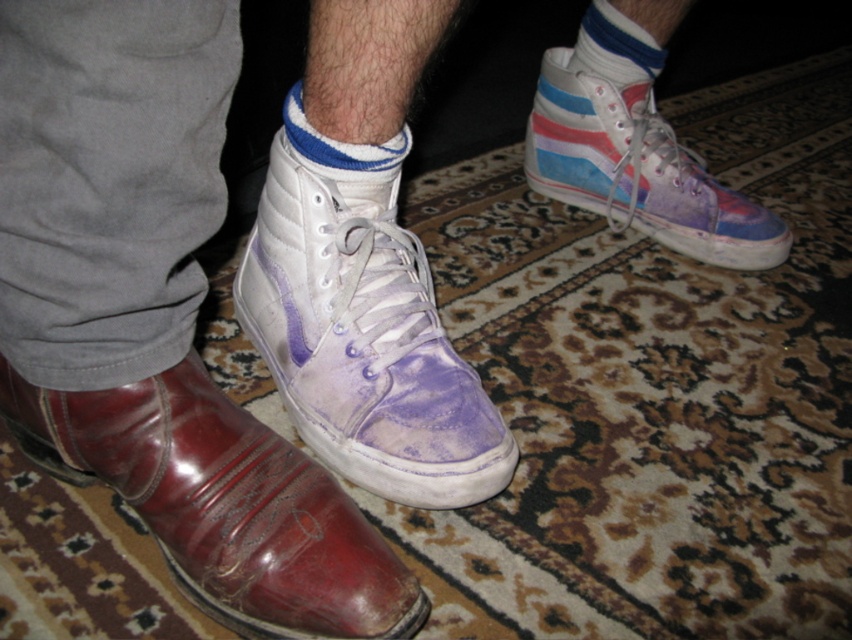
Question: Considering the real-world distances, which object is farthest from the shiny brown leather boot at lower left?

Choices:
 (A) blue striped sock at center
 (B) blue striped sock at upper center
 (C) purple suede sneaker at upper right

Answer: (B)

Question: Which of the following is the closest to the observer?

Choices:
 (A) (401, 448)
 (B) (568, 99)
 (C) (659, 72)
 (D) (314, 509)

Answer: (D)

Question: Does shiny brown leather boot at lower left come in front of blue striped sock at center?

Choices:
 (A) yes
 (B) no

Answer: (A)

Question: Can you confirm if blue striped sock at upper center is bigger than blue striped sock at center?

Choices:
 (A) no
 (B) yes

Answer: (B)

Question: Which of the following is the farthest from the observer?

Choices:
 (A) purple suede sneaker at upper right
 (B) purple suede sneaker at center
 (C) blue striped sock at center
 (D) shiny brown leather boot at lower left

Answer: (A)

Question: Can you confirm if purple suede sneaker at center is positioned below shiny brown leather boot at lower left?

Choices:
 (A) yes
 (B) no

Answer: (B)